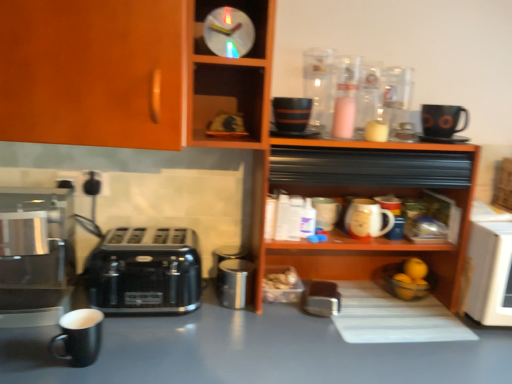
Identify the location of free space to the right of black matte mug at lower left. 151,356.